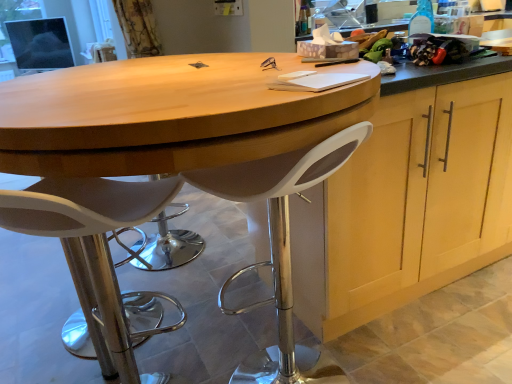
Measure the distance between point (108, 337) and camera.

Point (108, 337) and camera are 3.70 feet apart from each other.

What are the coordinates of `white plastic stool at center, the second chair viewed from the left` in the screenshot? It's located at (278, 238).

In the scene shown: Would you consider light wood cabinet at center to be distant from white plastic stool at lower left, positioned as the second chair in right-to-left order?

light wood cabinet at center is near white plastic stool at lower left, positioned as the second chair in right-to-left order, not far away.

Which of these two, light wood cabinet at center or white plastic stool at lower left, positioned as the 1th chair in left-to-right order, is smaller?

Smaller between the two is white plastic stool at lower left, positioned as the 1th chair in left-to-right order.

Between light wood cabinet at center and white plastic stool at lower left, positioned as the second chair in right-to-left order, which one is positioned behind?

light wood cabinet at center is behind.

From a real-world perspective, is light wood cabinet at center under white plastic stool at lower left, positioned as the second chair in right-to-left order?

No, from a real-world perspective, light wood cabinet at center is not under white plastic stool at lower left, positioned as the second chair in right-to-left order.

Is white plastic stool at lower left, positioned as the second chair in right-to-left order, behind wooden table at center?

Yes, white plastic stool at lower left, positioned as the second chair in right-to-left order, is further from the viewer.

Considering the sizes of objects white plastic stool at lower left, positioned as the second chair in right-to-left order, and wooden table at center in the image provided, who is taller, white plastic stool at lower left, positioned as the second chair in right-to-left order, or wooden table at center?

wooden table at center.

Which object is positioned more to the right, white plastic stool at lower left, positioned as the 1th chair in left-to-right order, or wooden table at center?

wooden table at center is more to the right.

Is white plastic stool at lower left, positioned as the second chair in right-to-left order, wider than wooden table at center?

Incorrect, the width of white plastic stool at lower left, positioned as the second chair in right-to-left order, does not surpass that of wooden table at center.

Is white plastic stool at center, the second chair viewed from the left, in front of or behind light wood cabinet at center in the image?

Clearly, white plastic stool at center, the second chair viewed from the left, is in front of light wood cabinet at center.

Between point (193, 174) and point (483, 114), which one is positioned behind?

Point (483, 114)

Is white plastic stool at center, which is the first chair from right to left, positioned with its back to light wood cabinet at center?

That's not correct — white plastic stool at center, which is the first chair from right to left, is not looking away from light wood cabinet at center.

In terms of height, does white plastic stool at center, which is the first chair from right to left, look taller or shorter compared to light wood cabinet at center?

Considering their sizes, white plastic stool at center, which is the first chair from right to left, has less height than light wood cabinet at center.

From the image's perspective, is light wood cabinet at center positioned above or below wooden table at center?

Based on their image positions, light wood cabinet at center is located above wooden table at center.

Consider the image. Is light wood cabinet at center inside or outside of wooden table at center?

light wood cabinet at center exists outside the volume of wooden table at center.

From a real-world perspective, is light wood cabinet at center beneath wooden table at center?

Yes, from a real-world perspective, light wood cabinet at center is under wooden table at center.

Which object is closer to the camera, white plastic stool at center, which is the first chair from right to left, or white plastic stool at lower left, positioned as the second chair in right-to-left order?

white plastic stool at lower left, positioned as the second chair in right-to-left order, is closer to the camera.

Is white plastic stool at center, which is the first chair from right to left, not close to white plastic stool at lower left, positioned as the second chair in right-to-left order?

No, white plastic stool at center, which is the first chair from right to left, is not far away from white plastic stool at lower left, positioned as the second chair in right-to-left order.

Between white plastic stool at center, which is the first chair from right to left, and white plastic stool at lower left, positioned as the second chair in right-to-left order, which one has smaller size?

With smaller size is white plastic stool at lower left, positioned as the second chair in right-to-left order.

Measure the distance from wooden table at center to light wood cabinet at center.

The distance of wooden table at center from light wood cabinet at center is 21.91 inches.

Would you say wooden table at center contains light wood cabinet at center?

No, light wood cabinet at center is located outside of wooden table at center.

From a real-world perspective, is wooden table at center positioned over light wood cabinet at center based on gravity?

Yes, from a real-world perspective, wooden table at center is above light wood cabinet at center.

Is wooden table at center smaller than light wood cabinet at center?

Incorrect, wooden table at center is not smaller in size than light wood cabinet at center.

Is wooden table at center to the left of white plastic stool at center, which is the first chair from right to left, from the viewer's perspective?

Yes, wooden table at center is to the left of white plastic stool at center, which is the first chair from right to left.

From a real-world perspective, is wooden table at center located beneath white plastic stool at center, the second chair viewed from the left?

No, from a real-world perspective, wooden table at center is not beneath white plastic stool at center, the second chair viewed from the left.

Who is taller, wooden table at center or white plastic stool at center, which is the first chair from right to left?

wooden table at center is taller.

Is wooden table at center not inside white plastic stool at center, which is the first chair from right to left?

Yes, wooden table at center is outside of white plastic stool at center, which is the first chair from right to left.

At what (x,y) coordinates should I click in order to perform the action: click on cabinetry located above the white plastic stool at lower left, positioned as the 1th chair in left-to-right order (from a real-world perspective). Please return your answer as a coordinate pair (x, y). The image size is (512, 384). Looking at the image, I should click on (419, 200).

Locate an element on the screen. chair that is the 2nd object directly below the wooden table at center (from a real-world perspective) is located at coordinates (95, 249).

Estimate the real-world distances between objects in this image. Which object is further from wooden table at center, white plastic stool at lower left, positioned as the 1th chair in left-to-right order, or white plastic stool at center, which is the first chair from right to left?

white plastic stool at center, which is the first chair from right to left.

Which object lies further to the anchor point light wood cabinet at center, white plastic stool at lower left, positioned as the 1th chair in left-to-right order, or white plastic stool at center, which is the first chair from right to left?

white plastic stool at lower left, positioned as the 1th chair in left-to-right order, lies further to light wood cabinet at center than the other object.

Estimate the real-world distances between objects in this image. Which object is closer to white plastic stool at center, which is the first chair from right to left, light wood cabinet at center or wooden table at center?

Among the two, wooden table at center is located nearer to white plastic stool at center, which is the first chair from right to left.

When comparing their distances from light wood cabinet at center, does wooden table at center or white plastic stool at lower left, positioned as the second chair in right-to-left order, seem further?

white plastic stool at lower left, positioned as the second chair in right-to-left order, is further to light wood cabinet at center.

Based on their spatial positions, is light wood cabinet at center or white plastic stool at center, which is the first chair from right to left, closer to wooden table at center?

white plastic stool at center, which is the first chair from right to left.

Which object lies further to the anchor point white plastic stool at center, which is the first chair from right to left, light wood cabinet at center or white plastic stool at lower left, positioned as the second chair in right-to-left order?

The object further to white plastic stool at center, which is the first chair from right to left, is light wood cabinet at center.

From the picture: Estimate the real-world distances between objects in this image. Which object is further from light wood cabinet at center, wooden table at center or white plastic stool at center, which is the first chair from right to left?

wooden table at center is positioned further to the anchor light wood cabinet at center.

Considering their positions, is wooden table at center positioned further to white plastic stool at lower left, positioned as the 1th chair in left-to-right order, than white plastic stool at center, the second chair viewed from the left?

Based on the image, white plastic stool at center, the second chair viewed from the left, appears to be further to white plastic stool at lower left, positioned as the 1th chair in left-to-right order.

Locate an element on the screen. The image size is (512, 384). chair situated between white plastic stool at lower left, positioned as the 1th chair in left-to-right order, and light wood cabinet at center from left to right is located at coordinates (278, 238).

This screenshot has width=512, height=384. In order to click on table between white plastic stool at lower left, positioned as the 1th chair in left-to-right order, and light wood cabinet at center in this screenshot , I will do `click(169, 115)`.

I want to click on table situated between white plastic stool at lower left, positioned as the 1th chair in left-to-right order, and white plastic stool at center, the second chair viewed from the left, from left to right, so click(x=169, y=115).

Find the location of `chair between wooden table at center and light wood cabinet at center in the horizontal direction`. chair between wooden table at center and light wood cabinet at center in the horizontal direction is located at coordinates (278, 238).